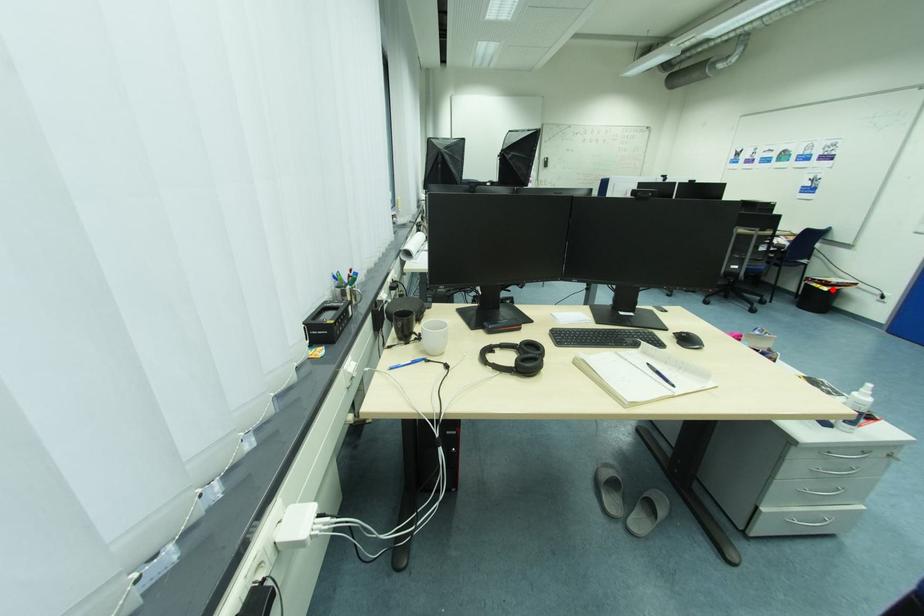
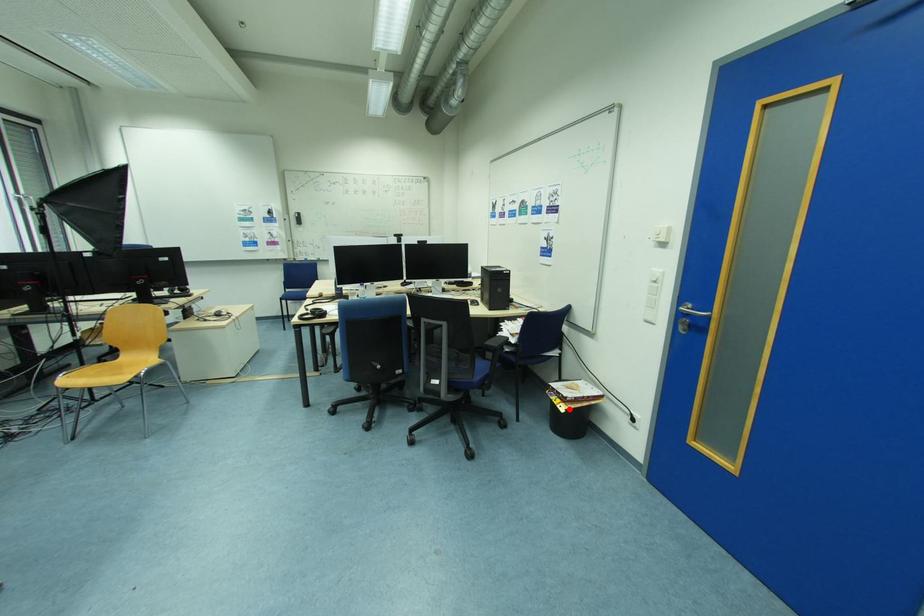
I am providing you with two images of the same scene from different viewpoints. A red point is marked on the first image and another point is marked on the second image. Do the highlighted points in image1 and image2 indicate the same real-world spot?

Yes